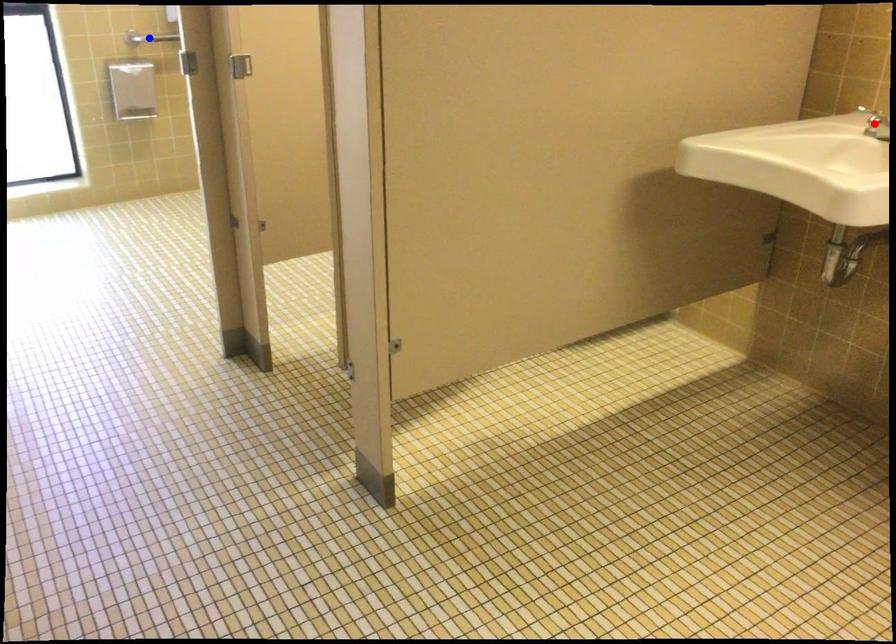
Question: Two points are marked on the image. Which point is closer to the camera?

Choices:
 (A) Blue point is closer.
 (B) Red point is closer.

Answer: (B)